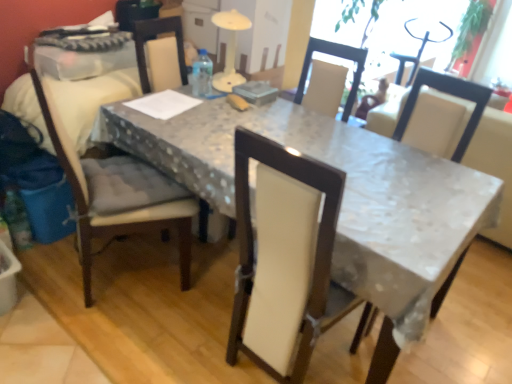
Identify the location of free location in front of matte beige cushioned chair at left, the 2th chair when ordered from right to left. (99, 343).